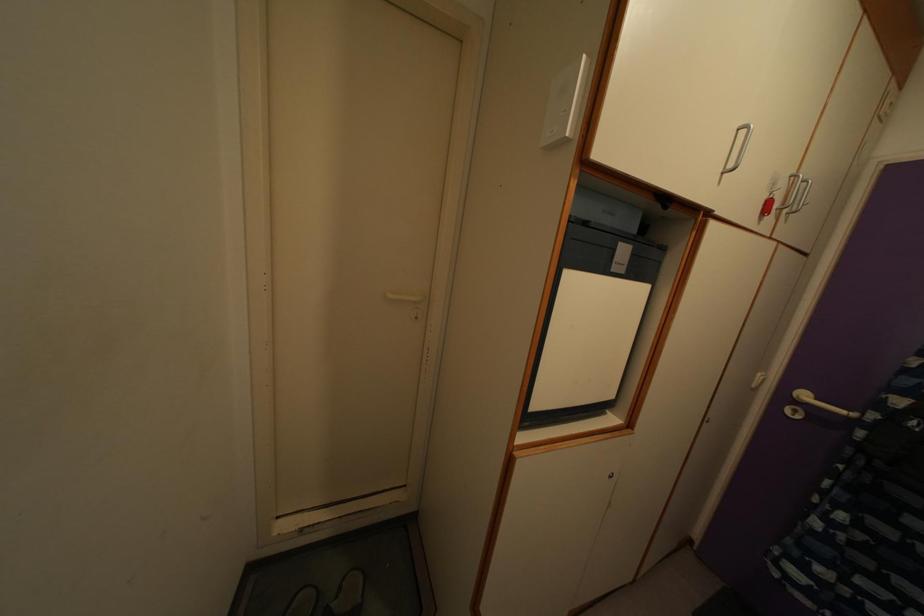
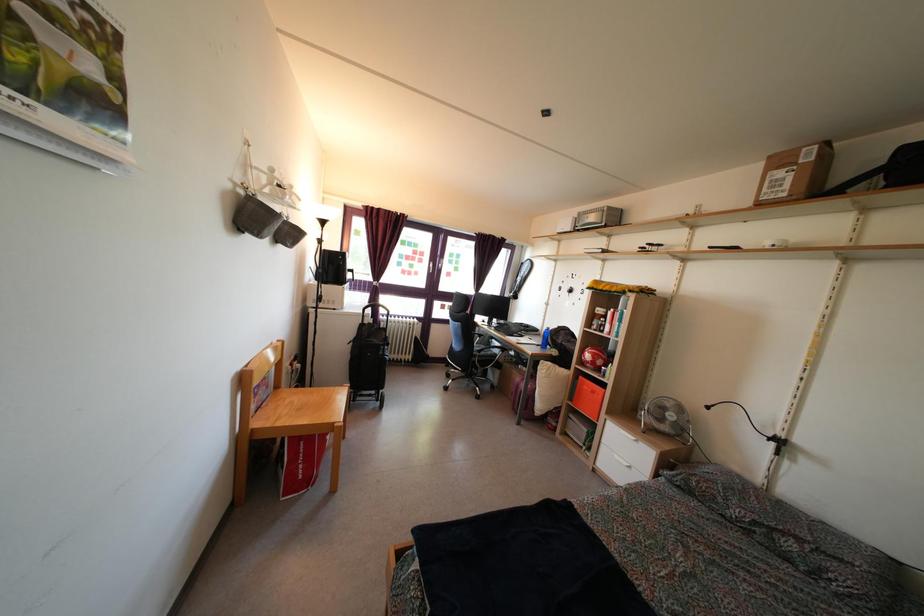
Question: Based on the continuous images, in which direction is the camera rotating? Reply with the corresponding letter.

Choices:
 (A) Left
 (B) Right
 (C) Up
 (D) Down

Answer: (A)